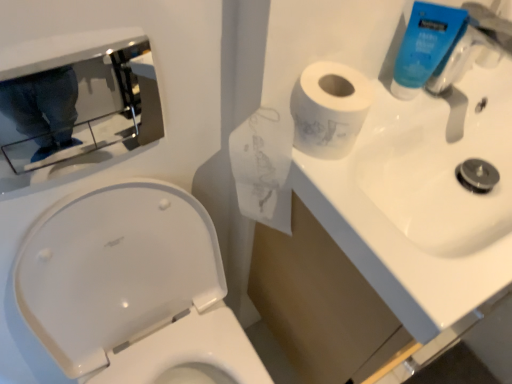
Question: Does white glossy sink at upper right have a larger size compared to blue plastic tube at upper right?

Choices:
 (A) no
 (B) yes

Answer: (B)

Question: Can you confirm if white glossy sink at upper right is positioned to the left of blue plastic tube at upper right?

Choices:
 (A) no
 (B) yes

Answer: (A)

Question: Does white glossy sink at upper right lie in front of blue plastic tube at upper right?

Choices:
 (A) yes
 (B) no

Answer: (A)

Question: Does white glossy sink at upper right have a greater width compared to blue plastic tube at upper right?

Choices:
 (A) yes
 (B) no

Answer: (A)

Question: Is white glossy sink at upper right shorter than blue plastic tube at upper right?

Choices:
 (A) no
 (B) yes

Answer: (B)

Question: Considering the relative sizes of white glossy sink at upper right and blue plastic tube at upper right in the image provided, is white glossy sink at upper right thinner than blue plastic tube at upper right?

Choices:
 (A) no
 (B) yes

Answer: (A)

Question: Does blue plastic tube at upper right come behind white glossy toilet at lower left?

Choices:
 (A) yes
 (B) no

Answer: (A)

Question: Can you confirm if blue plastic tube at upper right is shorter than white glossy toilet at lower left?

Choices:
 (A) no
 (B) yes

Answer: (B)

Question: From the image's perspective, is blue plastic tube at upper right on top of white glossy toilet at lower left?

Choices:
 (A) no
 (B) yes

Answer: (B)

Question: Is blue plastic tube at upper right to the left of white glossy toilet at lower left from the viewer's perspective?

Choices:
 (A) no
 (B) yes

Answer: (A)

Question: Does blue plastic tube at upper right have a greater height compared to white glossy toilet at lower left?

Choices:
 (A) yes
 (B) no

Answer: (B)

Question: From a real-world perspective, is blue plastic tube at upper right on white glossy toilet at lower left?

Choices:
 (A) yes
 (B) no

Answer: (A)

Question: From a real-world perspective, does white glossy sink at upper right sit lower than white glossy toilet at lower left?

Choices:
 (A) no
 (B) yes

Answer: (A)